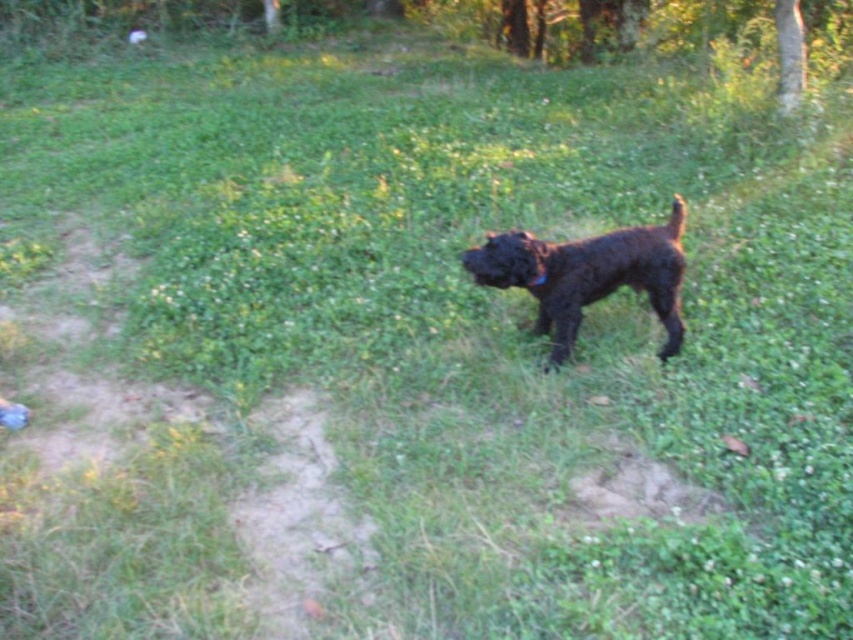
Can you confirm if shiny black dog at center is positioned below black fabric neckband at center?

Incorrect, shiny black dog at center is not positioned below black fabric neckband at center.

How much distance is there between shiny black dog at center and black fabric neckband at center?

They are 11.43 inches apart.

Is point (627, 278) behind point (537, 264)?

Yes.

Where is `shiny black dog at center`? The width and height of the screenshot is (853, 640). shiny black dog at center is located at coordinates 589,275.